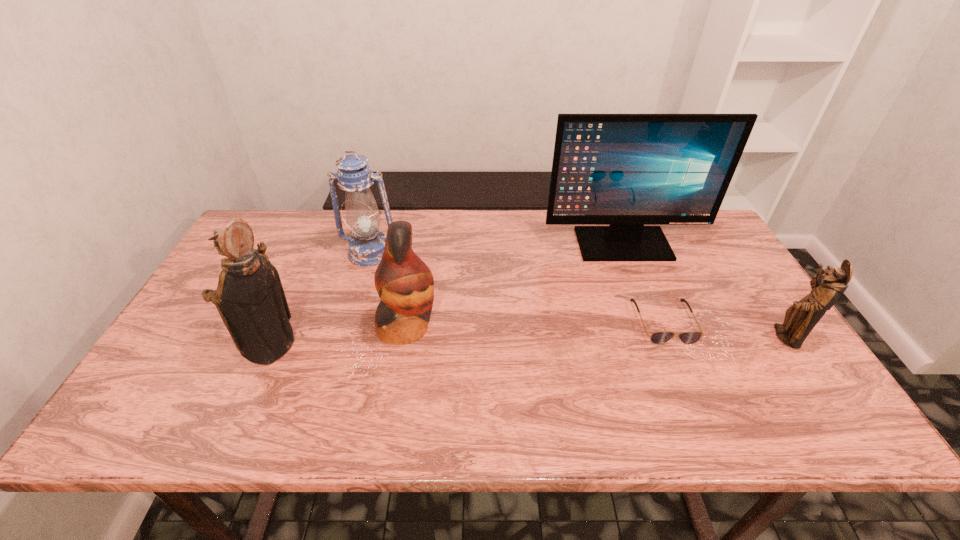
In order to click on the taller figurine in this screenshot , I will do `click(250, 298)`.

Where is `the leftmost object`? The height and width of the screenshot is (540, 960). the leftmost object is located at coordinates (250, 298).

Locate an element on the screen. This screenshot has height=540, width=960. the shorter figurine is located at coordinates (800, 318).

At what (x,y) coordinates should I click in order to perform the action: click on the rightmost object. Please return your answer as a coordinate pair (x, y). This screenshot has width=960, height=540. Looking at the image, I should click on (800, 318).

Locate an element on the screen. Image resolution: width=960 pixels, height=540 pixels. monitor is located at coordinates (623, 170).

I want to click on the shortest object, so click(x=690, y=337).

Image resolution: width=960 pixels, height=540 pixels. I want to click on lantern, so click(x=366, y=247).

You are a GUI agent. You are given a task and a screenshot of the screen. Output one action in this format:
    pyautogui.click(x=<x>, y=<y>)
    Task: Click on the parrot
    
    Given the screenshot: What is the action you would take?
    pyautogui.click(x=404, y=283)

Where is `blank space located on the front-facing side of the left figurine`? This screenshot has height=540, width=960. blank space located on the front-facing side of the left figurine is located at coordinates (176, 346).

Locate an element on the screen. free space located 0.110m on the front-facing side of the left figurine is located at coordinates (196, 346).